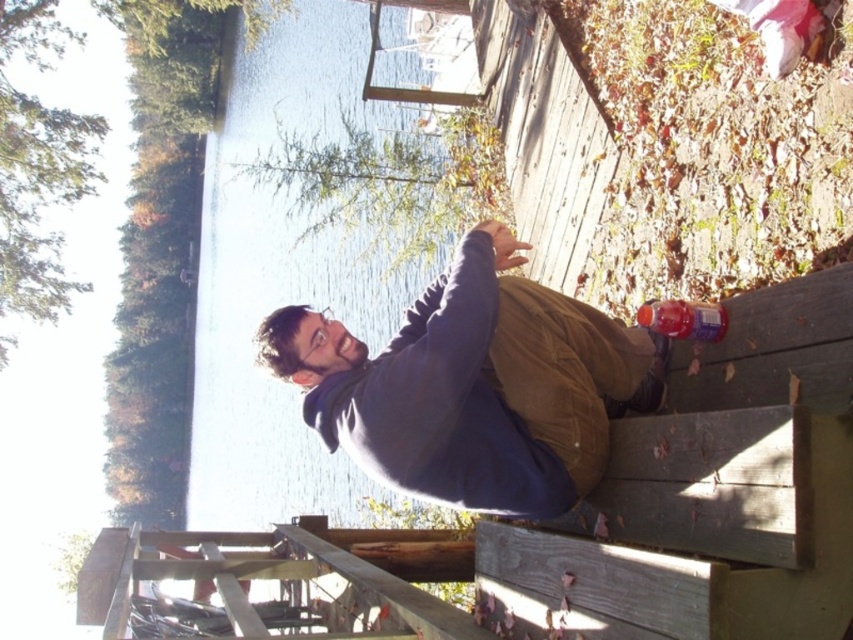
Question: Can you confirm if matte blue hoodie at center is positioned to the left of translucent plastic bottle at lower right?

Choices:
 (A) no
 (B) yes

Answer: (B)

Question: Which of the following is the closest to the observer?

Choices:
 (A) (683, 314)
 (B) (494, 280)

Answer: (B)

Question: Does matte blue hoodie at center have a larger size compared to translucent plastic bottle at lower right?

Choices:
 (A) no
 (B) yes

Answer: (B)

Question: Can you confirm if matte blue hoodie at center is positioned above translucent plastic bottle at lower right?

Choices:
 (A) yes
 (B) no

Answer: (B)